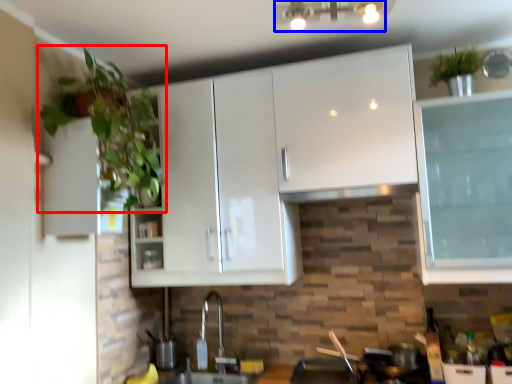
Question: Which object is further to the camera taking this photo, houseplant (highlighted by a red box) or light fixture (highlighted by a blue box)?

Choices:
 (A) houseplant
 (B) light fixture

Answer: (A)